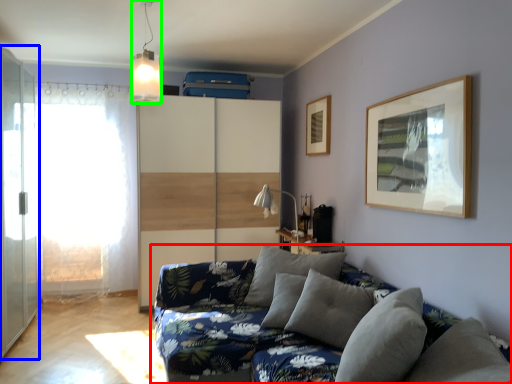
Question: Based on their relative distances, which object is farther from studio couch (highlighted by a red box)? Choose from screen door (highlighted by a blue box) and light fixture (highlighted by a green box).

Choices:
 (A) screen door
 (B) light fixture

Answer: (B)